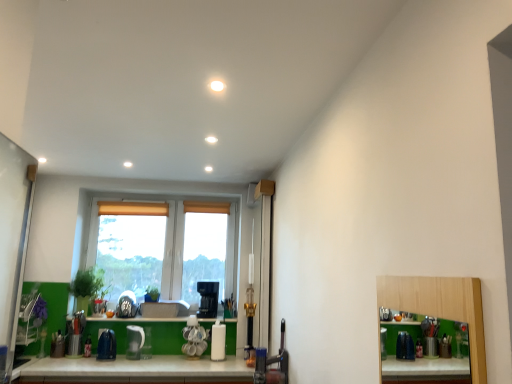
Question: In the image, is white glossy kettle at center, placed as the second appliance when sorted from right to left, on the left side or the right side of white glossy coffee maker at center, placed as the 3th appliance when sorted from left to right?

Choices:
 (A) right
 (B) left

Answer: (B)

Question: In terms of width, does white glossy kettle at center, placed as the 2th appliance when sorted from left to right, look wider or thinner when compared to white glossy coffee maker at center, placed as the 3th appliance when sorted from left to right?

Choices:
 (A) wide
 (B) thin

Answer: (A)

Question: Which object is the farthest from the black plastic coffee machine at center?

Choices:
 (A) white glossy coffee maker at center, placed as the 3th appliance when sorted from left to right
 (B) white glossy kettle at center, placed as the 2th appliance when sorted from left to right
 (C) blue plastic kettle at lower center, the third appliance positioned from the right
 (D) green matte plant at center, which is the second plant in left-to-right order
 (E) green matte window sill at lower center

Answer: (C)

Question: Which object is the farthest from the white glossy kettle at center, placed as the second appliance when sorted from right to left?

Choices:
 (A) green matte plant at left, acting as the 1th plant starting from the left
 (B) green matte plant at center, which is the second plant in left-to-right order
 (C) green matte window sill at lower center
 (D) black plastic coffee machine at center
 (E) white plastic window at center

Answer: (E)